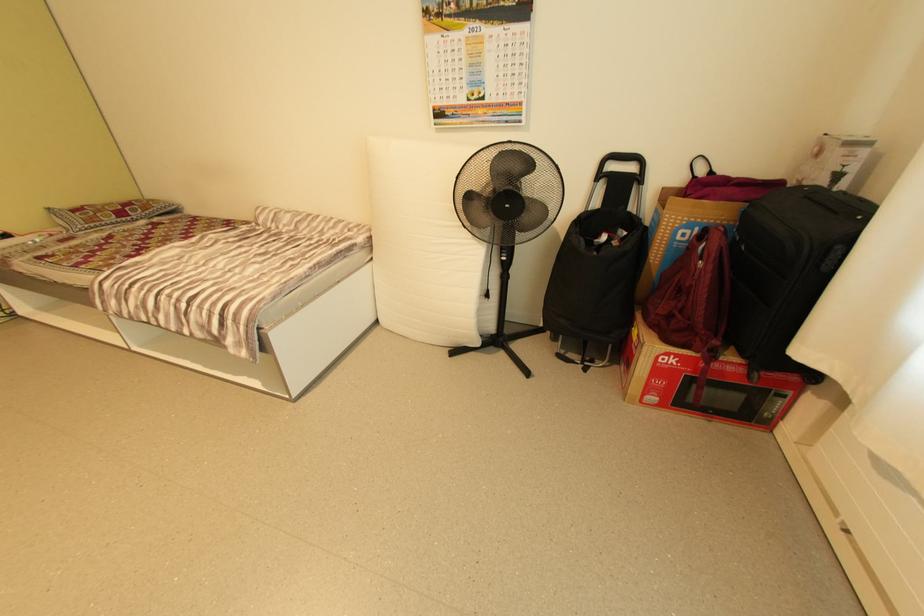
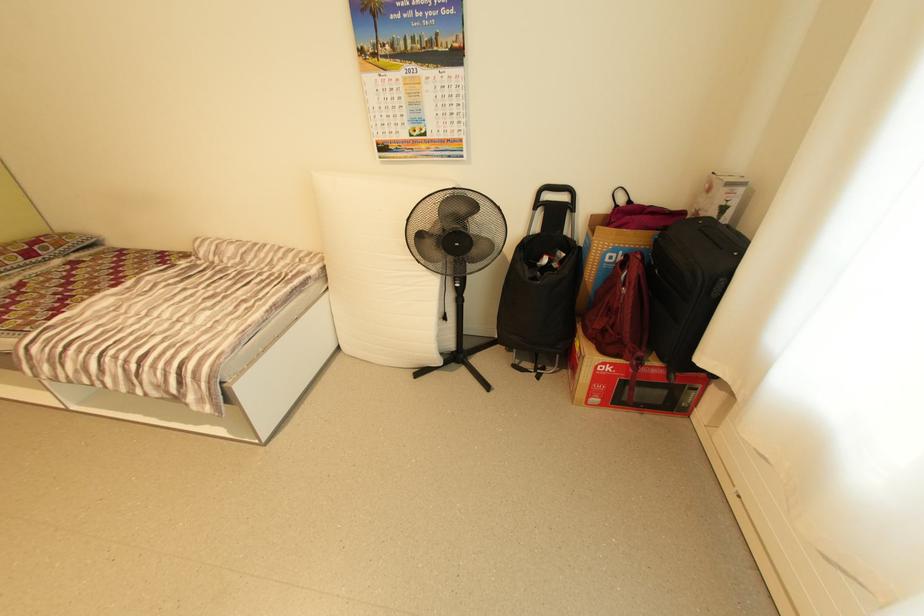
The point at (638, 169) is marked in the first image. Where is the corresponding point in the second image?

(570, 198)